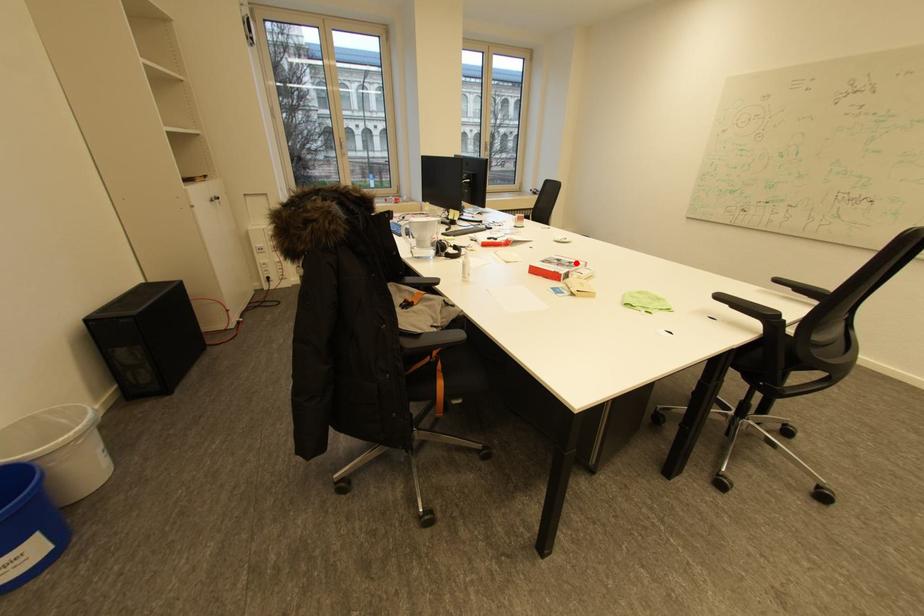
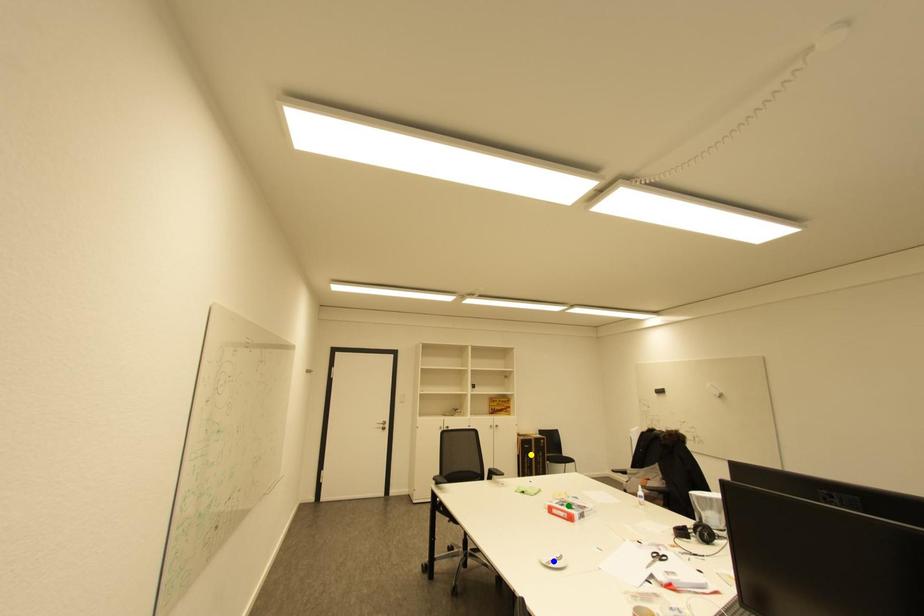
Question: I am providing you with two images of the same scene from different viewpoints. A red point is marked on the first image. You are given multiple points on the second image. Can you choose the point in image 2 that corresponds to the point in image 1?

Choices:
 (A) yellow point
 (B) green point
 (C) blue point

Answer: (B)